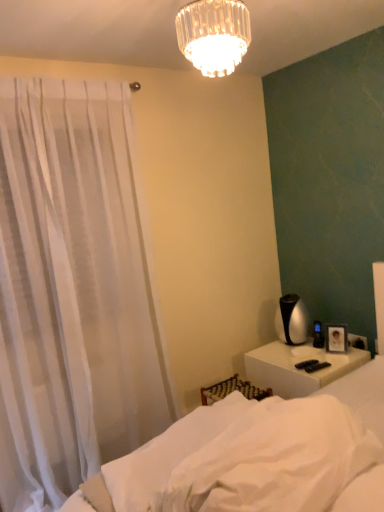
Question: From the image's perspective, is white soft fabric at lower center, placed as the 2th sheet when sorted from front to back, above or below white soft fabric bed at lower right?

Choices:
 (A) below
 (B) above

Answer: (A)

Question: Is point (89, 486) closer or farther from the camera than point (228, 434)?

Choices:
 (A) farther
 (B) closer

Answer: (A)

Question: Based on their relative distances, which object is nearer to the white soft fabric bed at lower right?

Choices:
 (A) white sheer curtain at left
 (B) white glossy nightstand at lower right
 (C) clear glass chandelier at upper center
 (D) white soft fabric at lower center, placed as the 2th sheet when sorted from front to back
 (E) white soft fabric at lower center, the second sheet when ordered from back to front

Answer: (E)

Question: Based on their relative distances, which object is farther from the white soft fabric at lower center, which is counted as the first sheet, starting from the back?

Choices:
 (A) white sheer curtain at left
 (B) white soft fabric bed at lower right
 (C) white soft fabric at lower center, the second sheet when ordered from back to front
 (D) clear glass chandelier at upper center
 (E) white glossy nightstand at lower right

Answer: (D)